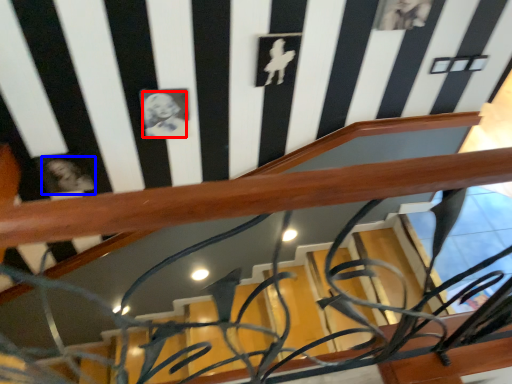
Question: Which object is closer to the camera taking this photo, art (highlighted by a red box) or art (highlighted by a blue box)?

Choices:
 (A) art
 (B) art

Answer: (A)